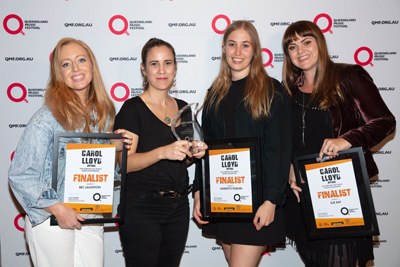
You are a GUI agent. You are given a task and a screenshot of the screen. Output one action in this format:
    pyautogui.click(x=<x>, y=<y>)
    Task: Click on the pendant
    
    Given the screenshot: What is the action you would take?
    pyautogui.click(x=167, y=119)